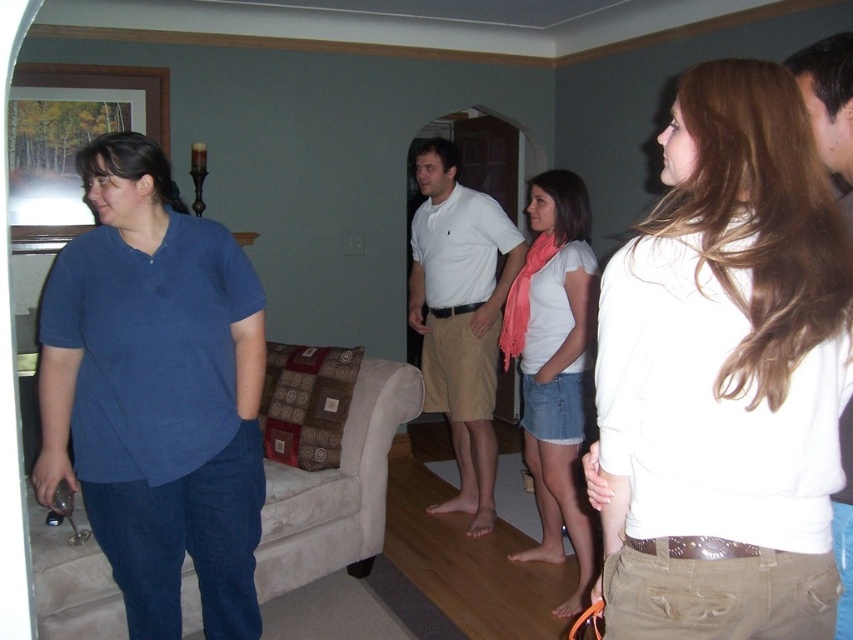
Question: Is white cotton polo shirt at center bigger than white cotton shirt at center?

Choices:
 (A) no
 (B) yes

Answer: (B)

Question: Which point is farther to the camera?

Choices:
 (A) (122, 550)
 (B) (454, 342)

Answer: (B)

Question: Is matte blue shirt at left further to camera compared to smooth beige shorts at center?

Choices:
 (A) yes
 (B) no

Answer: (A)

Question: Which point appears closest to the camera in this image?

Choices:
 (A) (689, 257)
 (B) (849, 138)
 (C) (427, 154)

Answer: (A)

Question: Based on their relative distances, which object is farther from the white cotton shirt at center?

Choices:
 (A) smooth beige shorts at center
 (B) matte blue shirt at left

Answer: (A)

Question: Is white cotton polo shirt at center thinner than white cotton shirt at center?

Choices:
 (A) no
 (B) yes

Answer: (A)